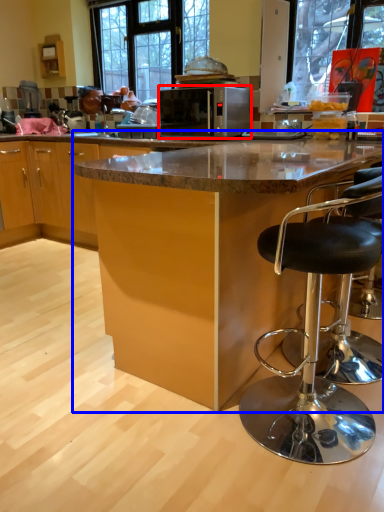
Question: Which point is further to the camera, microwave oven (highlighted by a red box) or table (highlighted by a blue box)?

Choices:
 (A) microwave oven
 (B) table

Answer: (A)